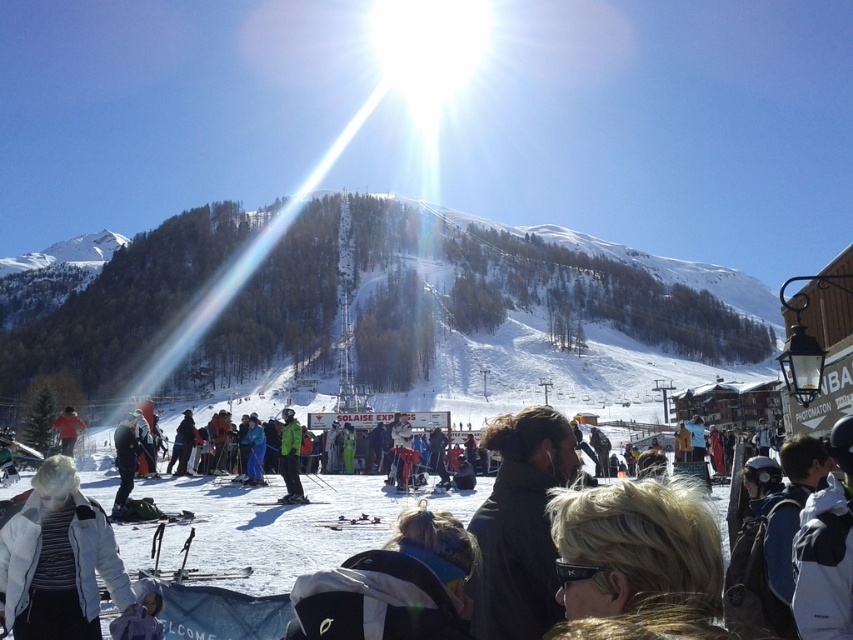
In the scene shown: You are a photographer standing at the edge of the ski resort. You want to take a photo of the white snowboarders at center and the green matte jacket at center. Which one will appear larger in your photo?

The white snowboarders at center will appear larger in the photo because they are closer to the viewer than the green matte jacket at center.

You are a photographer standing at the ski resort and want to take a photo of the white fleece jacket at lower left and the matte black skis at center. Which object should you focus on first to ensure both are in the frame?

The white fleece jacket at lower left is positioned over matte black skis at center, so you should focus on the white fleece jacket at lower left first to ensure both are in the frame.